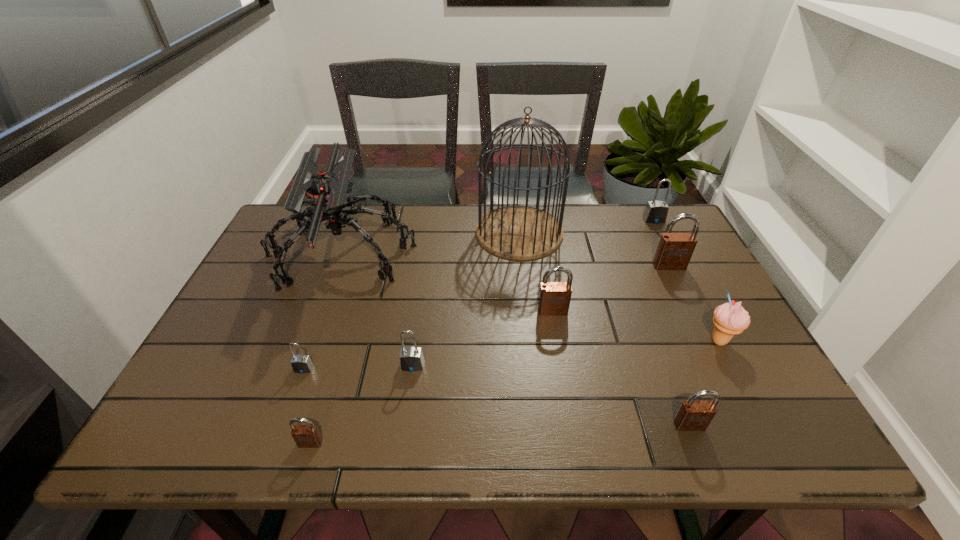
Where is `vacant space at the near left corner of the desktop`? This screenshot has height=540, width=960. vacant space at the near left corner of the desktop is located at coordinates (221, 440).

Locate an element on the screen. free area in between the smallest gray padlock and the seventh object from right to left is located at coordinates (358, 367).

At what (x,y) coordinates should I click in order to perform the action: click on empty space that is in between the farthest padlock and the third brown padlock from left to right. Please return your answer as a coordinate pair (x, y). Looking at the image, I should click on (671, 322).

Where is `free spot between the ninth shortest object and the second gray padlock from left to right`? The width and height of the screenshot is (960, 540). free spot between the ninth shortest object and the second gray padlock from left to right is located at coordinates tap(377, 308).

Where is `free space that is in between the nearest object and the drone`? This screenshot has height=540, width=960. free space that is in between the nearest object and the drone is located at coordinates (326, 347).

Where is `vacant area that lies between the fourth object from left to right and the smallest gray padlock`? The width and height of the screenshot is (960, 540). vacant area that lies between the fourth object from left to right and the smallest gray padlock is located at coordinates (358, 367).

Identify the location of free space between the biggest brown padlock and the fourth object from left to right. The image size is (960, 540). (540, 316).

What are the coordinates of `vacant area between the tallest object and the drone` in the screenshot? It's located at (431, 241).

This screenshot has height=540, width=960. Identify the location of empty location between the smallest gray padlock and the birdcage. pos(412,300).

In order to click on vacant area that lies between the birdcage and the leftmost gray padlock in this screenshot , I will do `click(412, 300)`.